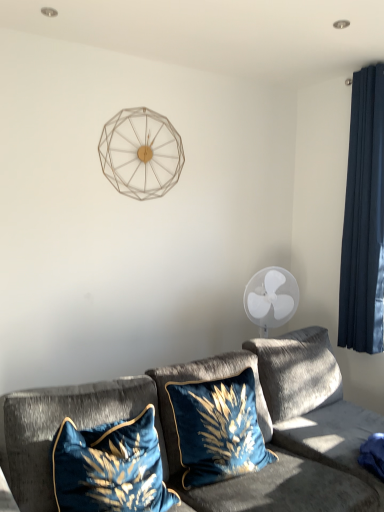
Question: Is metallic wireframe clock at upper center in front of or behind velvet blue pillow at center, which ranks as the 2th pillow in left-to-right order, in the image?

Choices:
 (A) front
 (B) behind

Answer: (B)

Question: From the image's perspective, relative to velvet blue pillow at center, which ranks as the 2th pillow in left-to-right order, is metallic wireframe clock at upper center above or below?

Choices:
 (A) above
 (B) below

Answer: (A)

Question: Which is nearer to the velvet blue pillow at center, which ranks as the 2th pillow in left-to-right order?

Choices:
 (A) dark blue velvet curtain at right
 (B) metallic wireframe clock at upper center
 (C) velvet blue pillow at lower left, acting as the 2th pillow starting from the right
 (D) velvet gray couch at lower center

Answer: (D)

Question: Which of these objects is positioned farthest from the velvet blue pillow at center, which ranks as the 2th pillow in left-to-right order?

Choices:
 (A) metallic wireframe clock at upper center
 (B) dark blue velvet curtain at right
 (C) velvet blue pillow at lower left, acting as the 2th pillow starting from the right
 (D) velvet gray couch at lower center

Answer: (A)